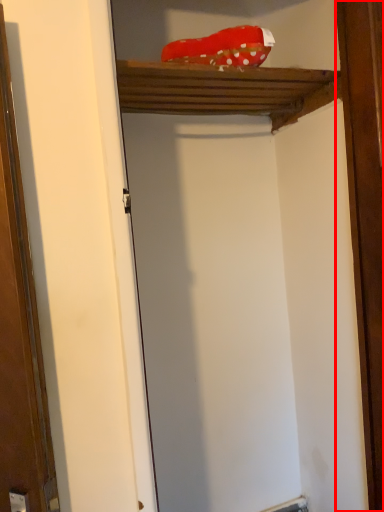
Question: From the image's perspective, what is the correct spatial positioning of barn door (annotated by the red box) in reference to cabinet?

Choices:
 (A) above
 (B) below

Answer: (B)